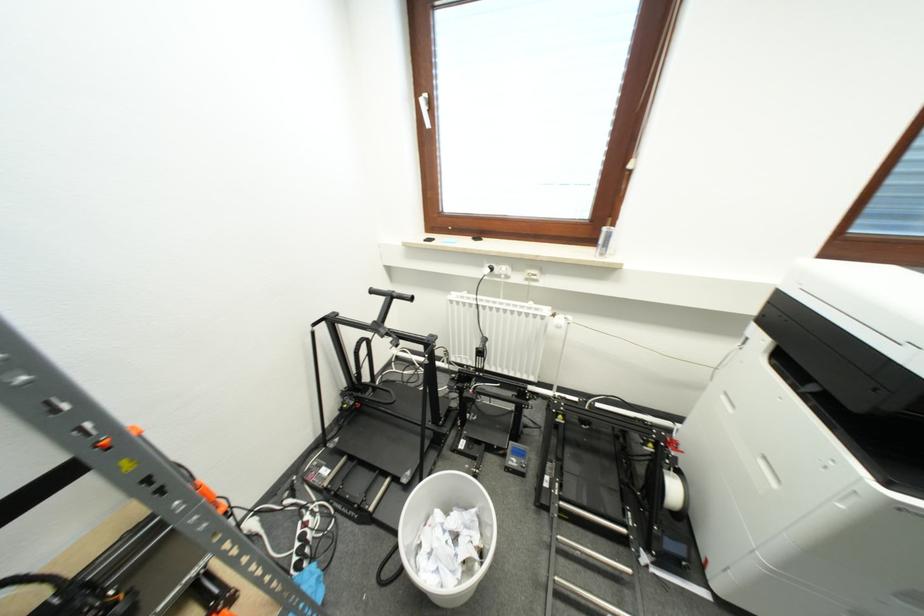
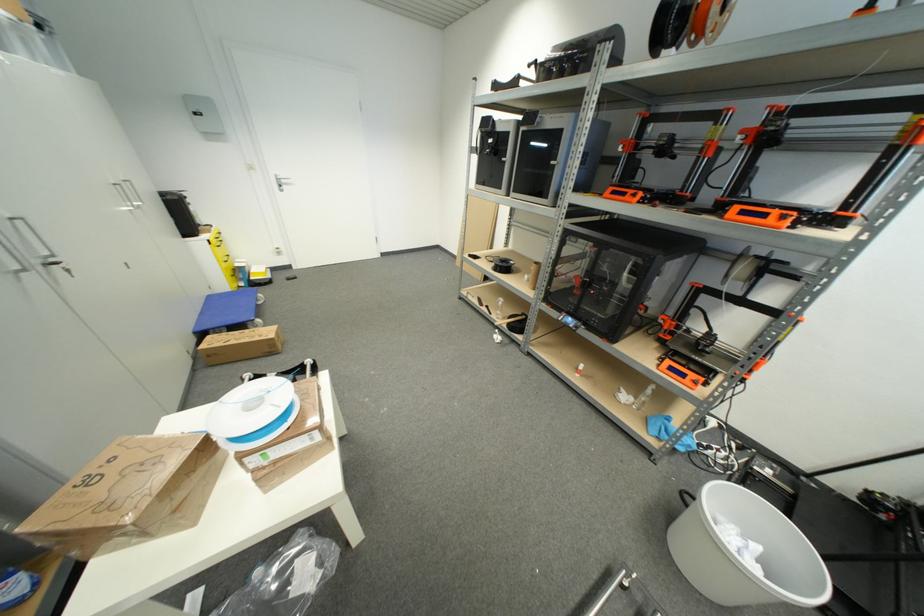
Where in the second image is the point corresponding to [443,517] from the first image?

(761, 551)